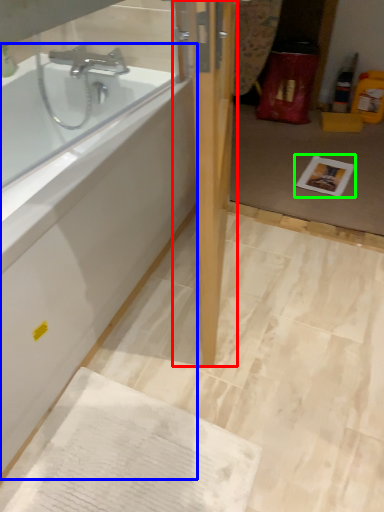
Question: Estimate the real-world distances between objects in this image. Which object is closer to door (highlighted by a red box), bathtub (highlighted by a blue box) or copy (highlighted by a green box)?

Choices:
 (A) bathtub
 (B) copy

Answer: (A)